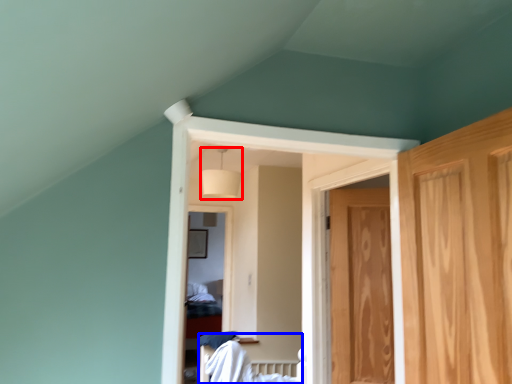
Question: Which of the following is the closest to the observer, lamp (highlighted by a red box) or bed (highlighted by a blue box)?

Choices:
 (A) lamp
 (B) bed

Answer: (B)